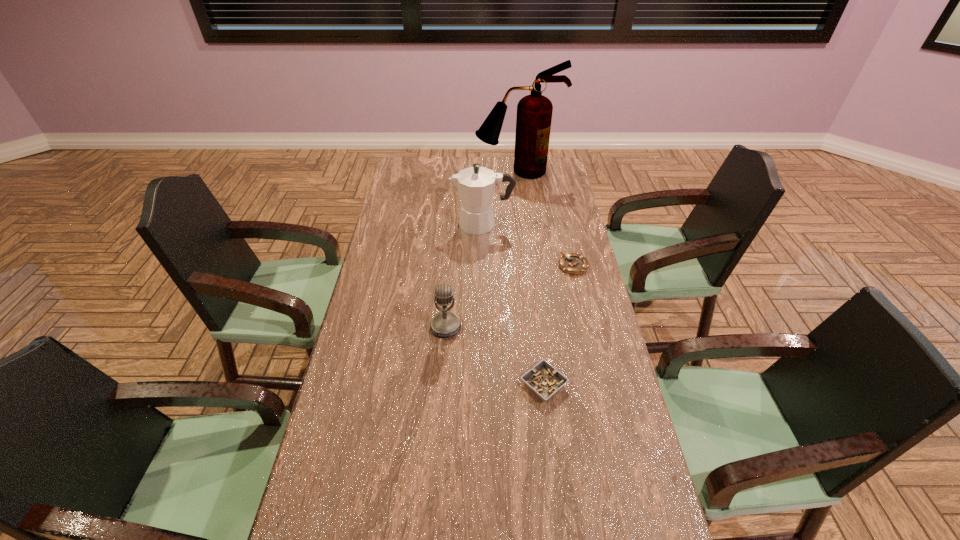
Locate an element on the screen. The width and height of the screenshot is (960, 540). fire extinguisher is located at coordinates (534, 112).

The image size is (960, 540). Find the location of `the farthest object`. the farthest object is located at coordinates (534, 112).

Find the location of a particular element. This screenshot has height=540, width=960. coffeepot is located at coordinates (476, 185).

Where is `the fourth nearest object`? the fourth nearest object is located at coordinates point(476,185).

The image size is (960, 540). Find the location of `the third shortest object`. the third shortest object is located at coordinates (444, 324).

Identify the location of the second nearest object. (444, 324).

Find the location of a particular element. Image resolution: width=960 pixels, height=540 pixels. the third nearest object is located at coordinates (572, 263).

Locate an element on the screen. This screenshot has height=540, width=960. the farther ashtray is located at coordinates (572, 263).

At what (x,y) coordinates should I click in order to perform the action: click on the nearer ashtray. Please return your answer as a coordinate pair (x, y). This screenshot has width=960, height=540. Looking at the image, I should click on (544, 380).

This screenshot has height=540, width=960. Identify the location of the left ashtray. (544, 380).